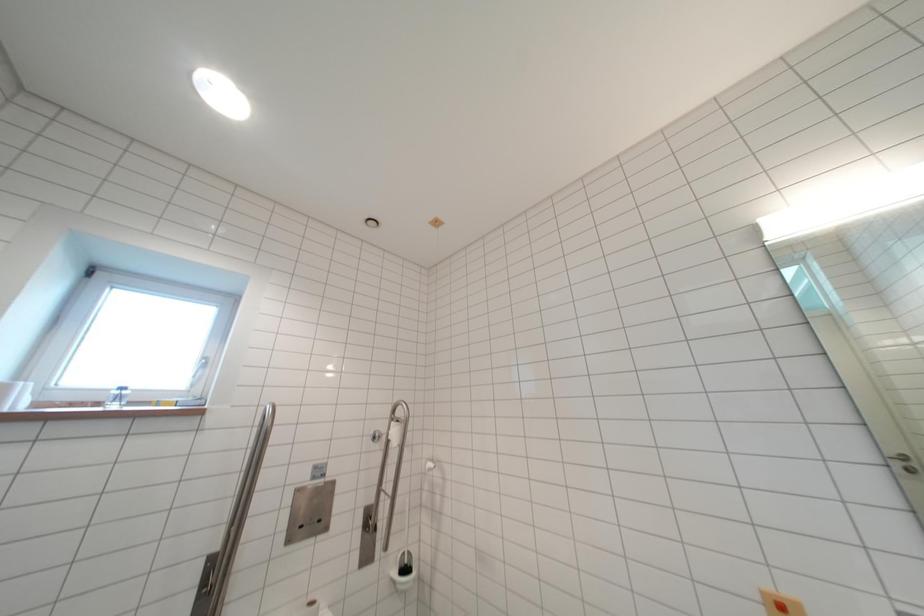
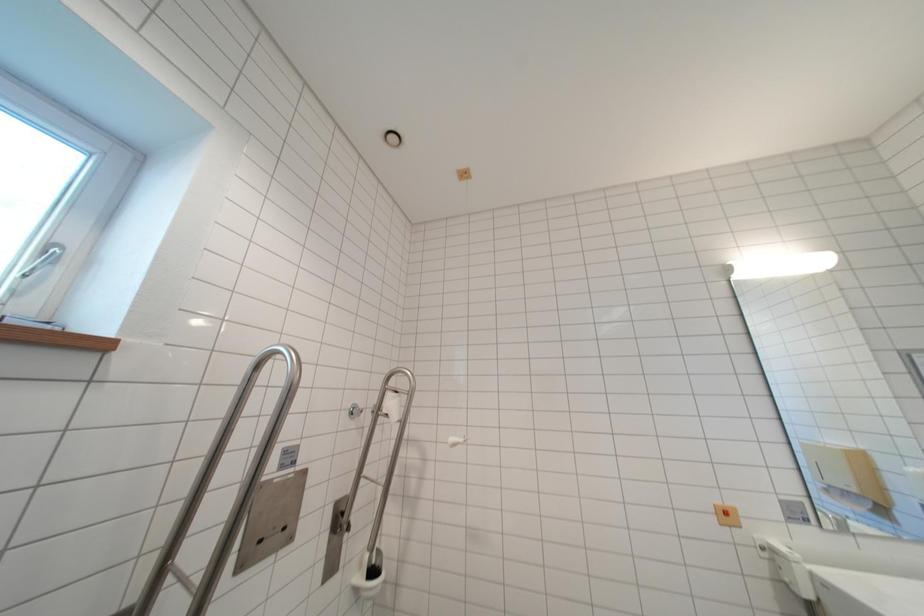
Question: Based on the continuous images, in which direction is the camera rotating? Reply with the corresponding letter.

Choices:
 (A) Left
 (B) Right
 (C) Up
 (D) Down

Answer: (B)